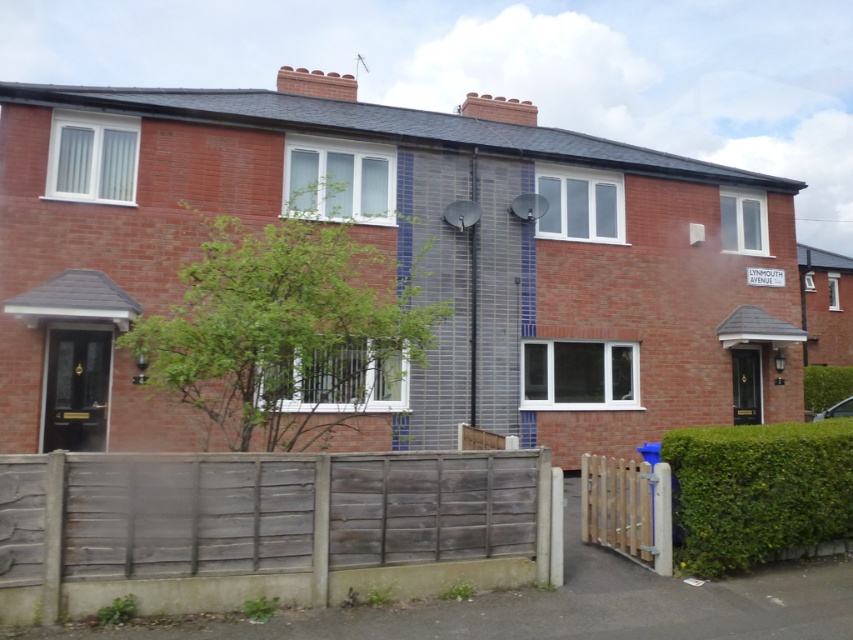
I want to click on weathered wood fence at lower center, so click(x=267, y=528).

Is weathered wood fence at lower center shorter than wooden picket gate at lower right?

No, weathered wood fence at lower center is not shorter than wooden picket gate at lower right.

Does point (239, 474) come behind point (601, 502)?

No.

Where is `weathered wood fence at lower center`? The height and width of the screenshot is (640, 853). weathered wood fence at lower center is located at coordinates (267, 528).

Based on the photo, is weathered wood fence at lower center to the left of green leafy hedge at lower right from the viewer's perspective?

Correct, you'll find weathered wood fence at lower center to the left of green leafy hedge at lower right.

Locate an element on the screen. This screenshot has width=853, height=640. weathered wood fence at lower center is located at coordinates (267, 528).

Is point (738, 512) farther from camera compared to point (646, 467)?

No.

From the picture: Between green leafy hedge at lower right and wooden picket gate at lower right, which one is positioned higher?

green leafy hedge at lower right is higher up.

I want to click on green leafy hedge at lower right, so click(x=757, y=490).